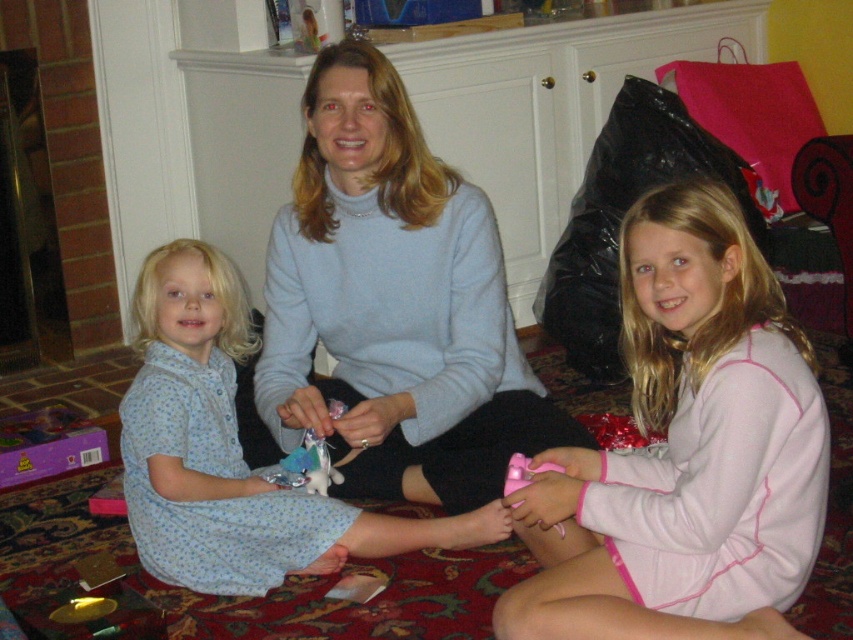
Based on the scene description, where is the light blue sweater at center located in the image?

The light blue sweater at center is located at point coordinates of 0.477 along the x axis and 0.463 along the y axis.

You are a parent trying to choose between two outfits for your child based on the image. The pink fleece pajamas at lower right and the blue floral dress at left are both options. Which outfit takes up more space when laid flat?

The blue floral dress at left has a greater width than the pink fleece pajamas at lower right, so the blue floral dress at left takes up more space when laid flat.

You are standing in the living room looking at the fireplace. There is a point marked at coordinates (x=685, y=451). Which object is located at this point?

The pink fleece pajamas at lower right is located at point (x=685, y=451).